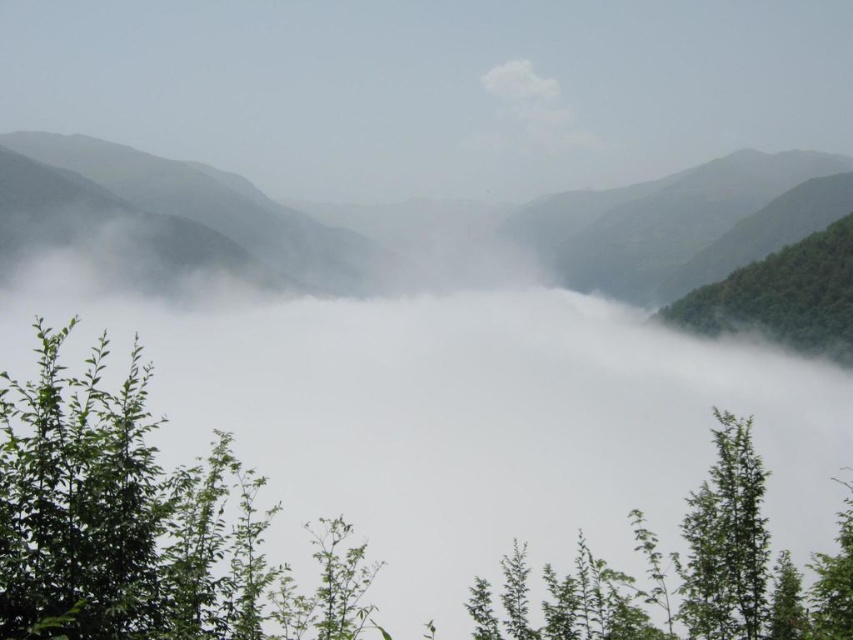
Who is taller, green leafy tree at right or white fluffy cloud at upper center?

With more height is white fluffy cloud at upper center.

Between green leafy tree at right and white fluffy cloud at upper center, which one has less height?

Standing shorter between the two is green leafy tree at right.

What do you see at coordinates (782, 296) in the screenshot? The image size is (853, 640). I see `green leafy tree at right` at bounding box center [782, 296].

Identify the location of green leafy tree at right. (782, 296).

Who is shorter, green leafy tree at lower right or white fluffy cloud at upper center?

With less height is green leafy tree at lower right.

Between point (735, 448) and point (547, 77), which one is positioned in front?

Positioned in front is point (735, 448).

At what (x,y) coordinates should I click in order to perform the action: click on green leafy tree at lower right. Please return your answer as a coordinate pair (x, y). Looking at the image, I should click on (727, 540).

Which of these two, green leafy tree at lower left or green matte mountain at center, stands shorter?

With less height is green leafy tree at lower left.

Measure the distance between point (22, 552) and camera.

12.01 meters

This screenshot has width=853, height=640. Find the location of `green leafy tree at lower left`. green leafy tree at lower left is located at coordinates (142, 524).